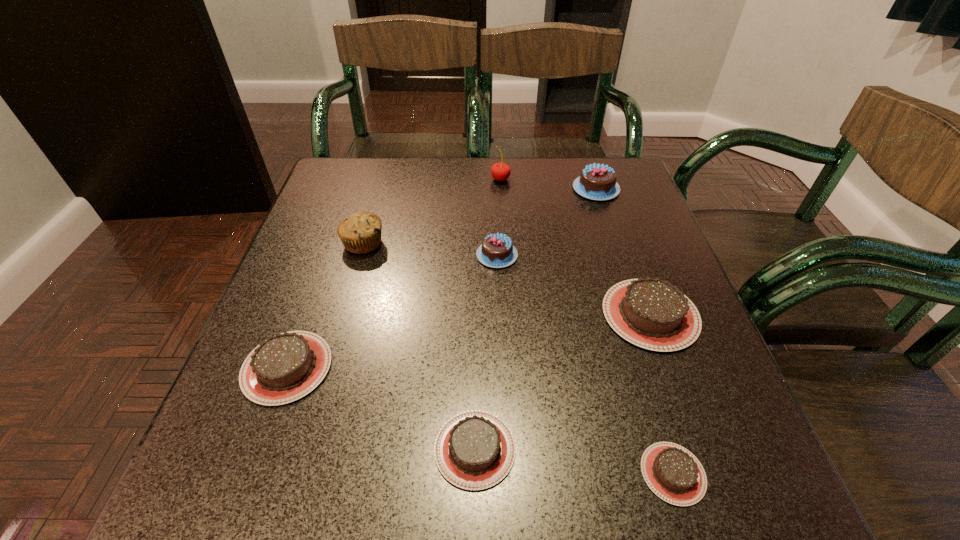
I want to click on cherry, so click(x=500, y=171).

Locate an element on the screen. the tallest object is located at coordinates (500, 171).

This screenshot has height=540, width=960. Find the location of `muffin`. muffin is located at coordinates (360, 233).

Locate an element on the screen. This screenshot has width=960, height=540. the bigger pink chocolate cake is located at coordinates (597, 182).

At what (x,y) coordinates should I click in order to perform the action: click on the sixth shortest object. Please return your answer as a coordinate pair (x, y). The height and width of the screenshot is (540, 960). Looking at the image, I should click on (597, 182).

At what (x,y) coordinates should I click in order to perform the action: click on the nearer pink chocolate cake. Please return your answer as a coordinate pair (x, y). The width and height of the screenshot is (960, 540). Looking at the image, I should click on (497, 251).

I want to click on the fifth nearest chocolate cake, so click(497, 251).

Locate an element on the screen. Image resolution: width=960 pixels, height=540 pixels. the biggest brown chocolate cake is located at coordinates (653, 314).

The image size is (960, 540). Find the location of `the third shortest object`. the third shortest object is located at coordinates (284, 368).

Where is `the leftmost chocolate cake`? the leftmost chocolate cake is located at coordinates (284, 368).